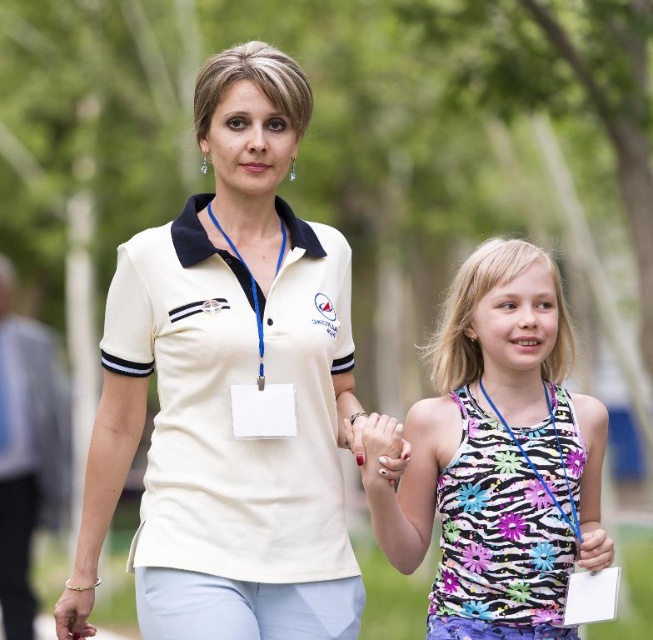
Measure the distance from white matte shirt at center to white matte lanyard at left.

They are 6.24 meters apart.

Is point (193, 624) farther from camera compared to point (25, 397)?

No, (193, 624) is in front of (25, 397).

The height and width of the screenshot is (640, 653). Identify the location of white matte shirt at center. (229, 388).

Based on the photo, is white matte shirt at center smaller than printed fabric tank top at center?

Actually, white matte shirt at center might be larger than printed fabric tank top at center.

Between white matte shirt at center and printed fabric tank top at center, which one has more height?

white matte shirt at center is taller.

This screenshot has height=640, width=653. In order to click on white matte shirt at center in this screenshot , I will do `click(229, 388)`.

Who is shorter, printed fabric tank top at center or white matte lanyard at left?

Standing shorter between the two is printed fabric tank top at center.

Between printed fabric tank top at center and white matte lanyard at left, which one is positioned higher?

printed fabric tank top at center

Is point (532, 387) positioned before point (22, 481)?

Yes, it is in front of point (22, 481).

I want to click on printed fabric tank top at center, so click(x=496, y=458).